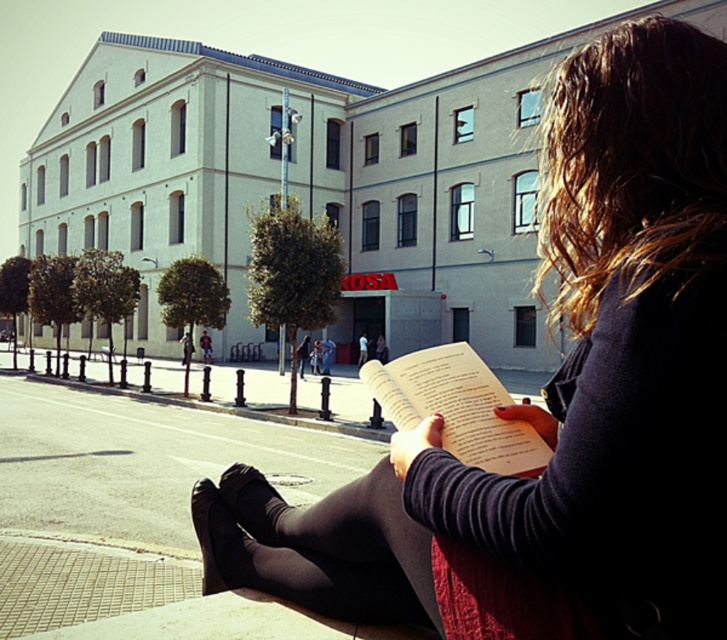
Identify the location of matte black book at center. (555, 403).

Does matte black book at center have a greater height compared to white paper book at center?

Correct, matte black book at center is much taller as white paper book at center.

Is point (675, 372) in front of point (454, 392)?

Yes, point (675, 372) is closer to viewer.

Where is `matte black book at center`? The height and width of the screenshot is (640, 727). matte black book at center is located at coordinates (555, 403).

Is point (656, 42) positioned after point (429, 614)?

That is False.

Can you confirm if matte black book at center is smaller than black tights at lower center?

Actually, matte black book at center might be larger than black tights at lower center.

Who is more distant from viewer, (610, 280) or (369, 531)?

The point (369, 531) is more distant.

Where is `matte black book at center`? This screenshot has width=727, height=640. matte black book at center is located at coordinates (555, 403).

Is point (324, 499) more distant than point (481, 460)?

Yes.

Does black tights at lower center come behind white paper book at center?

Yes, black tights at lower center is further from the viewer.

Between point (246, 518) and point (494, 470), which one is positioned in front?

Point (494, 470) is more forward.

I want to click on black tights at lower center, so click(x=318, y=547).